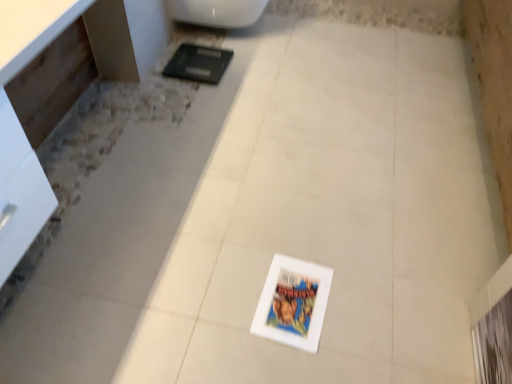
Question: Can you confirm if white glossy vanity at left is wider than white glossy toilet at upper center?

Choices:
 (A) yes
 (B) no

Answer: (B)

Question: Is white glossy vanity at left located outside white glossy toilet at upper center?

Choices:
 (A) yes
 (B) no

Answer: (A)

Question: Considering the relative positions of white glossy vanity at left and white glossy toilet at upper center in the image provided, is white glossy vanity at left to the left of white glossy toilet at upper center from the viewer's perspective?

Choices:
 (A) yes
 (B) no

Answer: (A)

Question: Does white glossy vanity at left appear on the right side of white glossy toilet at upper center?

Choices:
 (A) yes
 (B) no

Answer: (B)

Question: Would you say white glossy toilet at upper center is part of white glossy vanity at left's contents?

Choices:
 (A) no
 (B) yes

Answer: (A)

Question: Does white glossy vanity at left have a lesser width compared to white glossy toilet at upper center?

Choices:
 (A) no
 (B) yes

Answer: (B)

Question: Is white glossy vanity at left surrounded by white glossy toilet at upper center?

Choices:
 (A) no
 (B) yes

Answer: (A)

Question: Considering the relative positions of white glossy toilet at upper center and white glossy vanity at left in the image provided, is white glossy toilet at upper center to the left of white glossy vanity at left from the viewer's perspective?

Choices:
 (A) yes
 (B) no

Answer: (B)

Question: Is the depth of white glossy toilet at upper center less than that of white glossy vanity at left?

Choices:
 (A) yes
 (B) no

Answer: (B)

Question: Is white glossy toilet at upper center looking in the opposite direction of white glossy vanity at left?

Choices:
 (A) no
 (B) yes

Answer: (A)

Question: From a real-world perspective, is white glossy toilet at upper center positioned over white glossy vanity at left based on gravity?

Choices:
 (A) yes
 (B) no

Answer: (B)

Question: Is white glossy toilet at upper center far from white glossy vanity at left?

Choices:
 (A) yes
 (B) no

Answer: (B)

Question: From the image's perspective, is white glossy toilet at upper center located above or below white glossy vanity at left?

Choices:
 (A) above
 (B) below

Answer: (A)